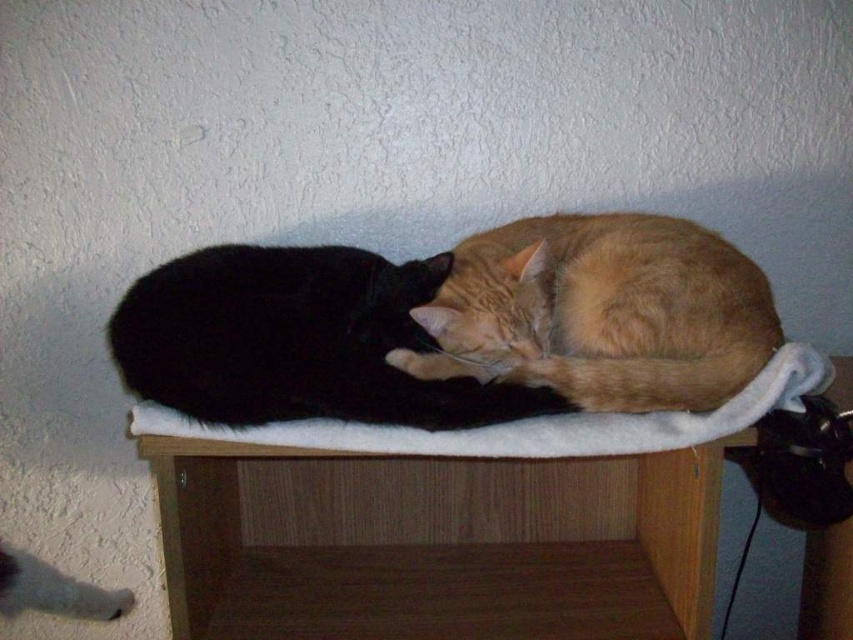
You are standing in front of the wooden surface where the two cats are resting. There are two points marked on the surface. One is at point (769, 323) and the other at point (184, 369). From your perspective, which point is closer to you?

Point (184, 369) is closer to you because it is in front of point (769, 323).

From the picture: You are a cat owner who wants to place a small blanket between the orange fur cat at center and the black fur cat at center to separate them. The blanket is 5 inches wide. Will it fit between them?

The orange fur cat at center and black fur cat at center are 5.55 inches apart, so the 5 inch wide blanket will fit between them since it is narrower than the space available.

You are a pet owner who wants to place a new cat tree next to the black fur cat at center and the white soft cat bed at center. Based on their heights, which one should the cat tree be placed next to to ensure it doesn

The black fur cat at center is taller than the white soft cat bed at center, so the cat tree should be placed next to the black fur cat at center to accommodate its height.